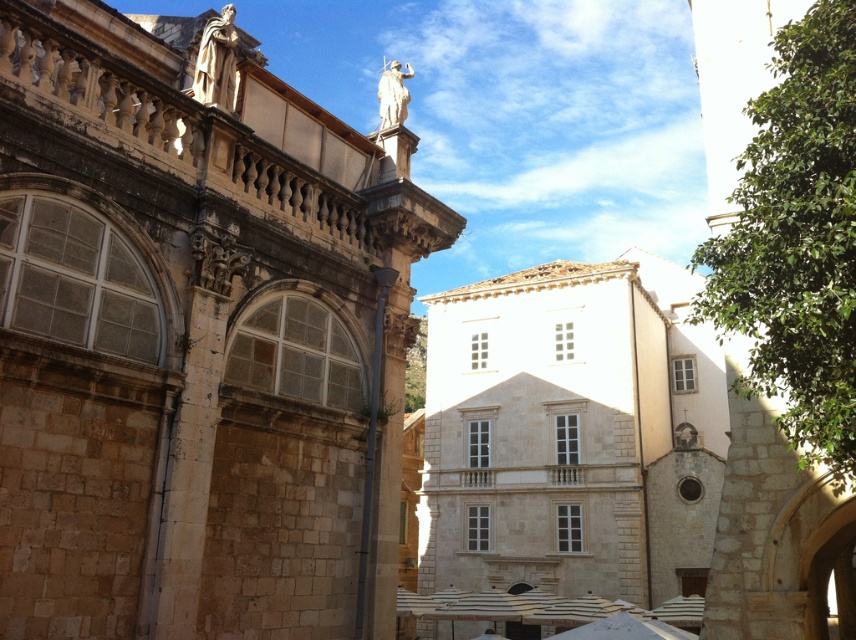
You are a tourist in Dubrovnik and want to take a photo of the white marble statue at upper left. The statue is located at point (217, 61). You are standing at point 0.0, 0.0. Which direction should you move to get closer to the statue?

The white marble statue at upper left is located at point (217, 61). Since you are at 0.0, 0.0, you should move northeast to get closer to the statue.

You are a tourist standing in the historic town and want to take a photo of the white marble statue at upper left. To ensure the statue is centered in your photo, where should you position yourself relative to the statue?

To center the white marble statue at upper left in your photo, position yourself directly in front of it at a distance that allows the statue to occupy the center of your camera frame. Since the statue is located at coordinates 0.097 on the x and 0.255 on the y, align your camera to focus precisely on those coordinates for optimal framing.